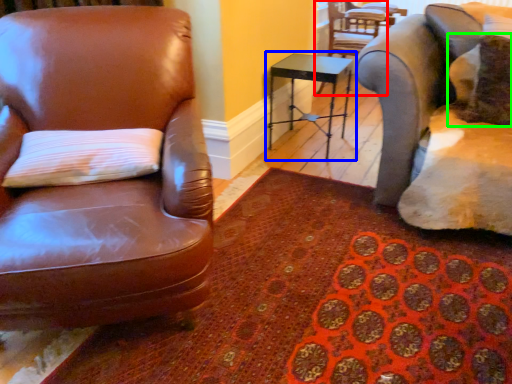
Question: Which is farther away from chair (highlighted by a red box)? table (highlighted by a blue box) or pillow (highlighted by a green box)?

Choices:
 (A) table
 (B) pillow

Answer: (B)